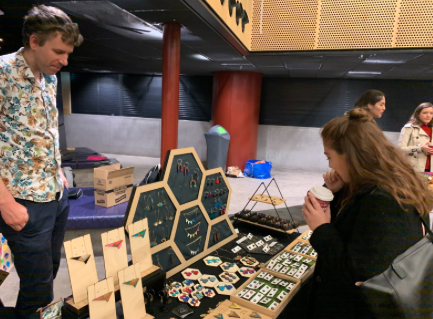
Locate an element on the screen. The height and width of the screenshot is (319, 433). recessed lighting is located at coordinates (109, 82), (105, 72).